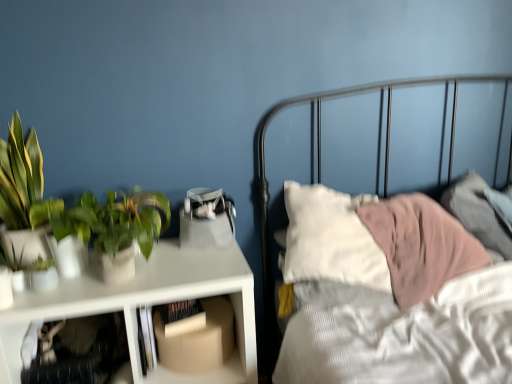
Question: Considering the positions of translucent plastic shelf at lower left, the first shelf when ordered from left to right, and white matte table at left in the image, is translucent plastic shelf at lower left, the first shelf when ordered from left to right, bigger or smaller than white matte table at left?

Choices:
 (A) big
 (B) small

Answer: (B)

Question: Does point (111, 312) appear closer or farther from the camera than point (162, 276)?

Choices:
 (A) closer
 (B) farther

Answer: (A)

Question: Which object is positioned closest to the translucent plastic shelf at lower left, the first shelf when ordered from left to right?

Choices:
 (A) green matte plant at left
 (B) hardcover book at center
 (C) green matte plant at left
 (D) white matte table at left
 (E) cardboard box at lower center, positioned as the first shelf in right-to-left order

Answer: (D)

Question: Estimate the real-world distances between objects in this image. Which object is farther from the translucent plastic shelf at lower left, acting as the 2th shelf starting from the right?

Choices:
 (A) white matte table at left
 (B) green matte plant at left
 (C) cardboard box at lower center, arranged as the second shelf when viewed from the left
 (D) hardcover book at center
 (E) green matte plant at left

Answer: (E)